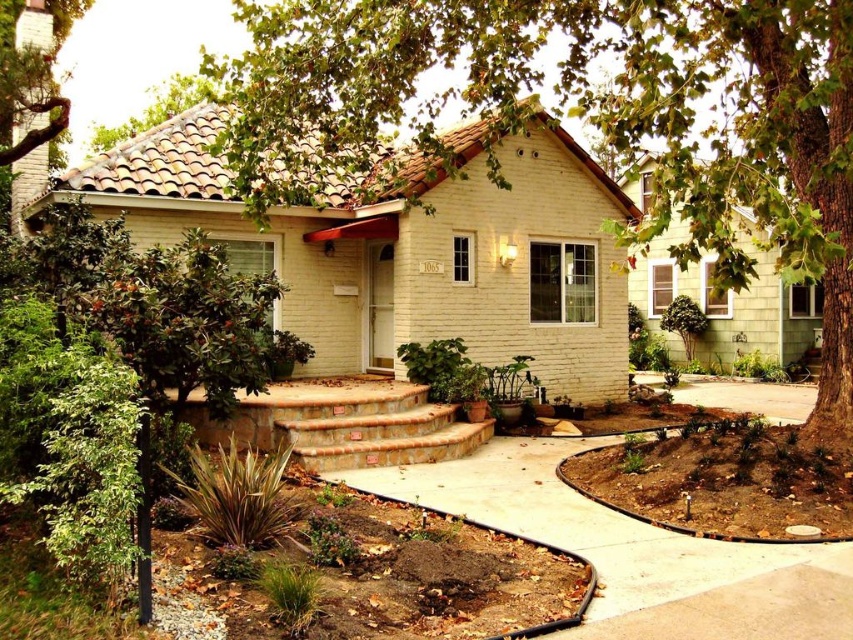
Is green leafy tree at center further to the viewer compared to green leafy tree at upper left?

No.

Who is lower down, green leafy tree at center or green leafy tree at upper left?

green leafy tree at center is lower down.

Who is more distant from viewer, (x=679, y=49) or (x=45, y=83)?

The point (x=45, y=83) is behind.

Locate an element on the screen. green leafy tree at center is located at coordinates (581, 115).

Which is in front, point (660, 552) or point (328, 394)?

Positioned in front is point (660, 552).

Can you confirm if brown concrete path at lower center is positioned to the right of terracotta brick stairs at center?

Correct, you'll find brown concrete path at lower center to the right of terracotta brick stairs at center.

Between point (376, 472) and point (283, 390), which one is positioned in front?

Point (376, 472)

What are the coordinates of `brown concrete path at lower center` in the screenshot? It's located at (631, 550).

Which is below, terracotta brick stairs at center or green leafy tree at upper left?

terracotta brick stairs at center is lower down.

Is point (393, 385) positioned in front of point (10, 156)?

No, (393, 385) is further to viewer.

This screenshot has width=853, height=640. I want to click on terracotta brick stairs at center, so [343, 422].